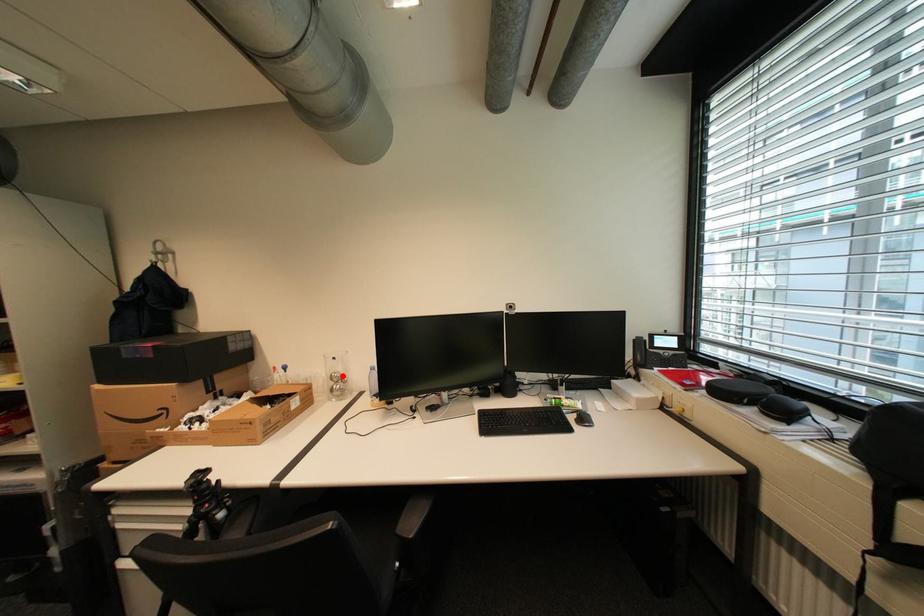
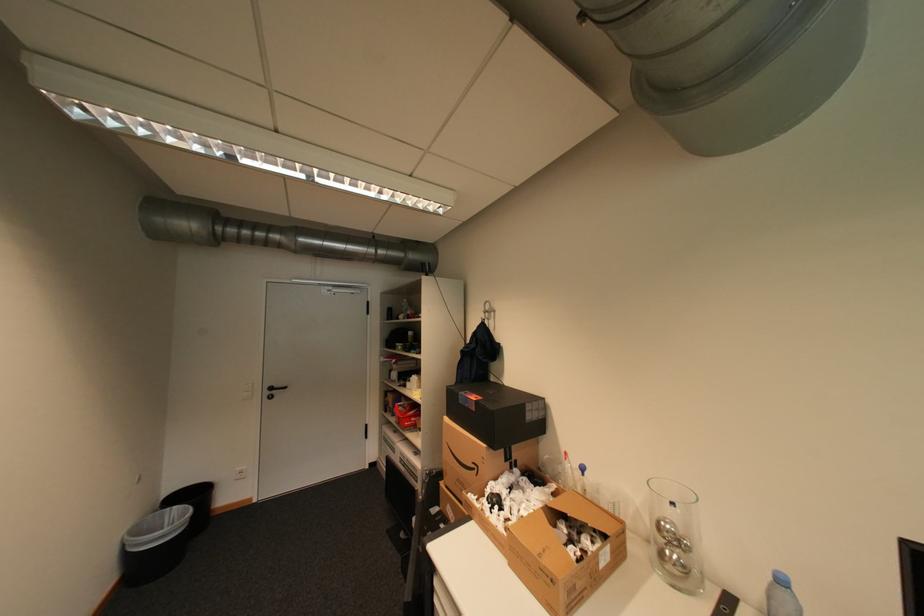
The point at the highlighted location is marked in the first image. Where is the corresponding point in the second image?

(673, 527)